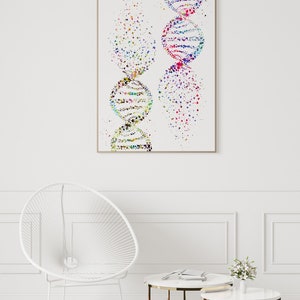
At what (x,y) coordinates should I click in order to perform the action: click on inner rectangle panels. Please return your answer as a coordinate pair (x, y). Looking at the image, I should click on coord(200,239), coord(286,240), coord(8,242).